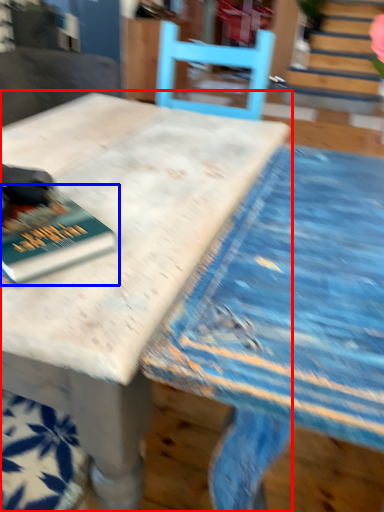
Question: Which of the following is the closest to the observer, table (highlighted by a red box) or book (highlighted by a blue box)?

Choices:
 (A) table
 (B) book

Answer: (A)